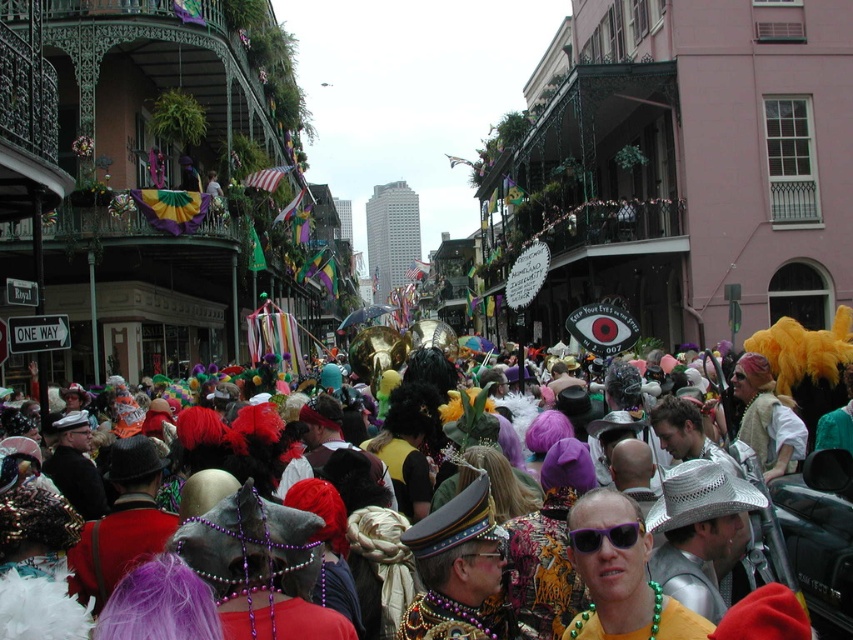
Question: Does multicolored feathers at center have a smaller size compared to shiny gold necklace at center?

Choices:
 (A) yes
 (B) no

Answer: (B)

Question: Considering the relative positions of multicolored feathers at center and purple plastic sunglasses at center in the image provided, where is multicolored feathers at center located with respect to purple plastic sunglasses at center?

Choices:
 (A) above
 (B) below

Answer: (A)

Question: Does shiny gold necklace at center appear on the right side of purple plastic sunglasses at center?

Choices:
 (A) no
 (B) yes

Answer: (B)

Question: Considering the real-world distances, which object is farthest from the multicolored feathers at center?

Choices:
 (A) purple plastic sunglasses at center
 (B) shiny gold necklace at center

Answer: (A)

Question: Estimate the real-world distances between objects in this image. Which object is farther from the purple plastic sunglasses at center?

Choices:
 (A) multicolored feathers at center
 (B) shiny gold necklace at center

Answer: (A)

Question: Estimate the real-world distances between objects in this image. Which object is closer to the purple plastic sunglasses at center?

Choices:
 (A) shiny gold necklace at center
 (B) multicolored feathers at center

Answer: (A)